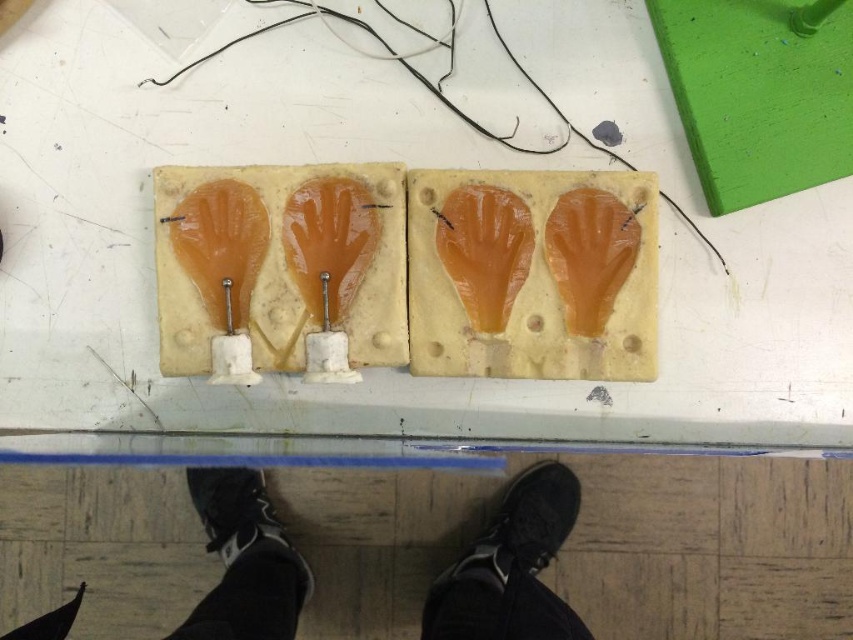
What do you see at coordinates (511, 566) in the screenshot? This screenshot has height=640, width=853. I see `black fabric pants at lower center` at bounding box center [511, 566].

Who is more forward, (223, 499) or (494, 609)?

Positioned in front is point (494, 609).

At what (x,y) coordinates should I click in order to perform the action: click on black fabric pants at lower center. Please return your answer as a coordinate pair (x, y). The width and height of the screenshot is (853, 640). Looking at the image, I should click on (511, 566).

The image size is (853, 640). I want to click on black fabric pants at lower center, so click(x=511, y=566).

How much distance is there between black synthetic shoe at lower center and black rubber shoe at lower center?

A distance of 7.56 inches exists between black synthetic shoe at lower center and black rubber shoe at lower center.

Is black synthetic shoe at lower center wider than black rubber shoe at lower center?

Correct, the width of black synthetic shoe at lower center exceeds that of black rubber shoe at lower center.

Describe the element at coordinates (511, 566) in the screenshot. The width and height of the screenshot is (853, 640). I see `black synthetic shoe at lower center` at that location.

Locate an element on the screen. Image resolution: width=853 pixels, height=640 pixels. black synthetic shoe at lower center is located at coordinates (511, 566).

The width and height of the screenshot is (853, 640). What do you see at coordinates (511, 566) in the screenshot?
I see `black fabric pants at lower center` at bounding box center [511, 566].

Is black fabric pants at lower center thinner than black rubber shoe at lower center?

Incorrect, black fabric pants at lower center's width is not less than black rubber shoe at lower center's.

Locate an element on the screen. This screenshot has height=640, width=853. black fabric pants at lower center is located at coordinates (511, 566).

Locate an element on the screen. This screenshot has width=853, height=640. black fabric pants at lower center is located at coordinates (511, 566).